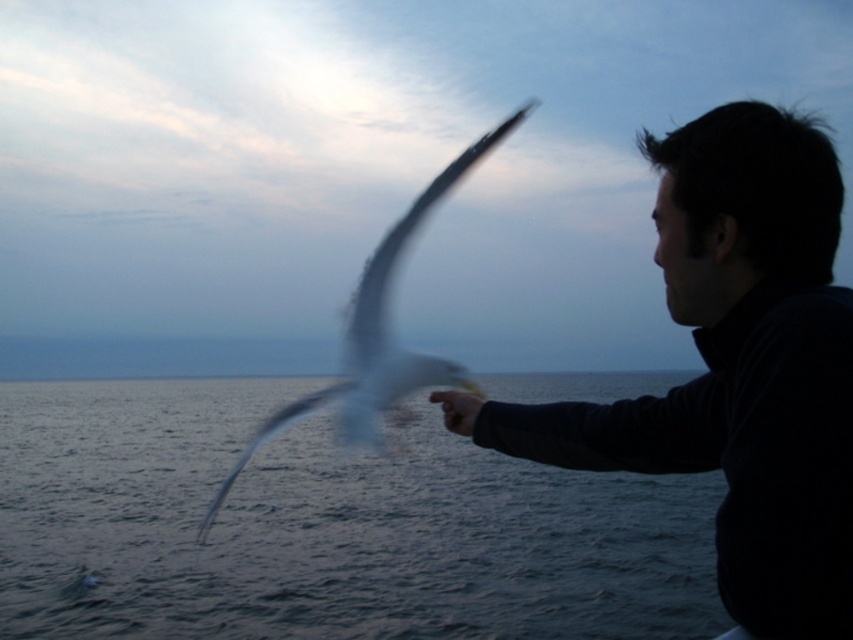
Does point (461, 625) lie in front of point (840, 493)?

No, it is not.

Is clear water at lower left above black matte fish at right?

No.

Find the location of `clear water at lower left`. clear water at lower left is located at coordinates (323, 529).

Is clear water at lower left in front of white feathered bird at center?

No.

Between clear water at lower left and white feathered bird at center, which one has more height?

white feathered bird at center

Measure the distance between point (274, 596) and camera.

They are 19.99 meters apart.

Locate an element on the screen. clear water at lower left is located at coordinates (323, 529).

Can you confirm if black matte fish at right is wider than white feathered bird at center?

No.

Does black matte fish at right have a smaller size compared to white feathered bird at center?

Correct, black matte fish at right occupies less space than white feathered bird at center.

Which is in front, point (692, 262) or point (397, 406)?

Point (692, 262)

Where is `black matte fish at right`? The image size is (853, 640). black matte fish at right is located at coordinates (735, 369).